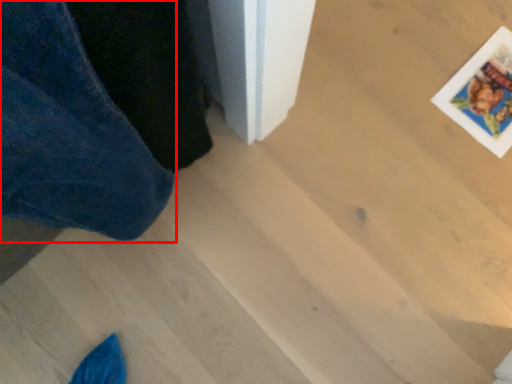
Question: Considering the relative positions of trousers (annotated by the red box) and postcard in the image provided, where is trousers (annotated by the red box) located with respect to the staircase?

Choices:
 (A) left
 (B) right

Answer: (A)